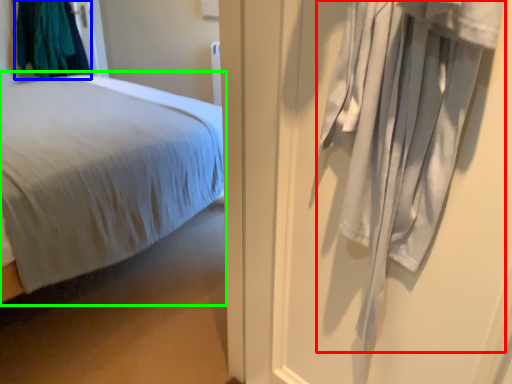
Question: Based on their relative distances, which object is nearer to curtain (highlighted by a red box)? Choose from clothing (highlighted by a blue box) and bed (highlighted by a green box).

Choices:
 (A) clothing
 (B) bed

Answer: (B)